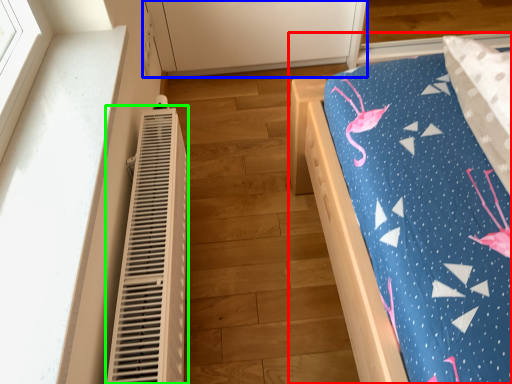
Question: Based on their relative distances, which object is farther from furniture (highlighted by a red box)? Choose from cabinetry (highlighted by a blue box) and heater (highlighted by a green box).

Choices:
 (A) cabinetry
 (B) heater

Answer: (A)